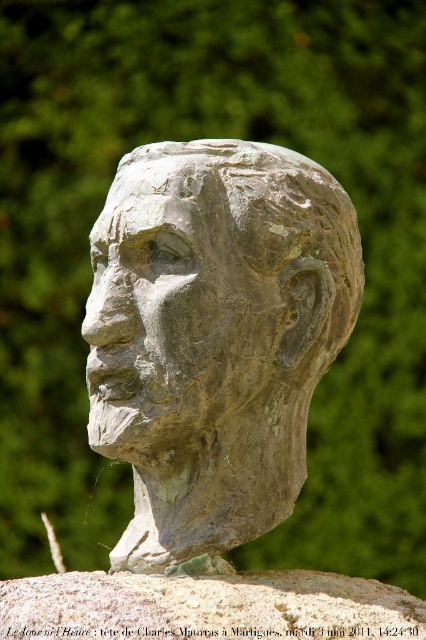
Looking at this image, you are an art restorer working on the sculpture in the park. You need to determine which object is narrower between the gray stone head at center and the gray stone bust at center. Which one is narrower?

The gray stone head at center is narrower than the gray stone bust at center.